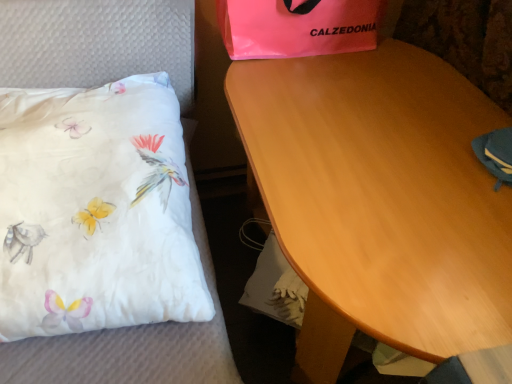
Question: Considering the positions of white satin pillow at left and wooden table at center in the image, is white satin pillow at left wider or thinner than wooden table at center?

Choices:
 (A) wide
 (B) thin

Answer: (B)

Question: Visually, is white satin pillow at left positioned to the left or to the right of wooden table at center?

Choices:
 (A) left
 (B) right

Answer: (A)

Question: Which of these objects is positioned closest to the pink plastic bag at upper center?

Choices:
 (A) white satin pillow at left
 (B) wooden table at center

Answer: (A)

Question: Which is farther from the wooden table at center?

Choices:
 (A) pink plastic bag at upper center
 (B) white satin pillow at left

Answer: (B)